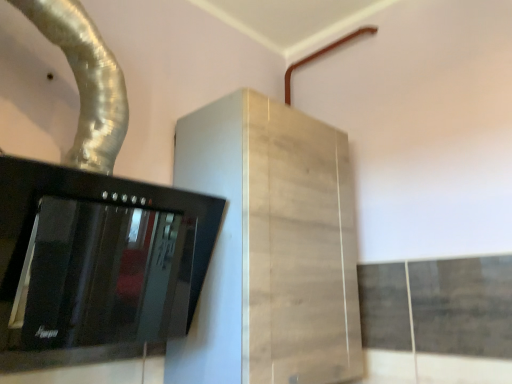
The width and height of the screenshot is (512, 384). What are the coordinates of `light wood cabinet at center` in the screenshot? It's located at (271, 247).

This screenshot has height=384, width=512. Describe the element at coordinates (96, 264) in the screenshot. I see `black glass stove at left` at that location.

What do you see at coordinates (322, 54) in the screenshot?
I see `brown matte pipe at upper right` at bounding box center [322, 54].

Locate an element on the screen. silver metallic duct at upper left is located at coordinates point(86,81).

I want to click on light wood cabinet at center, so click(x=271, y=247).

From a real-world perspective, is silver metallic duct at upper left on top of brown matte pipe at upper right?

No.

Does silver metallic duct at upper left have a smaller size compared to brown matte pipe at upper right?

No, silver metallic duct at upper left is not smaller than brown matte pipe at upper right.

Considering the relative sizes of silver metallic duct at upper left and brown matte pipe at upper right in the image provided, is silver metallic duct at upper left shorter than brown matte pipe at upper right?

Incorrect, the height of silver metallic duct at upper left does not fall short of that of brown matte pipe at upper right.

How many degrees apart are the facing directions of silver metallic duct at upper left and brown matte pipe at upper right?

87.6 degrees.

At what (x,y) coordinates should I click in order to perform the action: click on water pipe located above the light wood cabinet at center (from a real-world perspective). Please return your answer as a coordinate pair (x, y). The width and height of the screenshot is (512, 384). Looking at the image, I should click on (86, 81).

From the image's perspective, would you say light wood cabinet at center is positioned over silver metallic duct at upper left?

No, from the image's perspective, light wood cabinet at center is not on top of silver metallic duct at upper left.

Is light wood cabinet at center positioned with its back to silver metallic duct at upper left?

light wood cabinet at center does not have its back to silver metallic duct at upper left.

Which of these two, light wood cabinet at center or silver metallic duct at upper left, stands taller?

light wood cabinet at center.

Consider the image. Is black glass stove at left in contact with brown matte pipe at upper right?

No, black glass stove at left is not next to brown matte pipe at upper right.

Is point (42, 245) farther from viewer compared to point (348, 40)?

No, it is in front of (348, 40).

You are a GUI agent. You are given a task and a screenshot of the screen. Output one action in this format:
    pyautogui.click(x=<x>, y=<y>)
    Task: Click on the home appliance to the left of brown matte pipe at upper right
    Image resolution: width=512 pixels, height=384 pixels.
    Given the screenshot: What is the action you would take?
    pyautogui.click(x=96, y=264)

Could you tell me if black glass stove at left is facing brown matte pipe at upper right?

No, black glass stove at left is not aimed at brown matte pipe at upper right.

Between black glass stove at left and light wood cabinet at center, which one appears on the left side from the viewer's perspective?

From the viewer's perspective, black glass stove at left appears more on the left side.

In the scene shown: Does black glass stove at left have a lesser width compared to light wood cabinet at center?

Correct, the width of black glass stove at left is less than that of light wood cabinet at center.

Who is bigger, black glass stove at left or light wood cabinet at center?

A: light wood cabinet at center.

Which object is further away from the camera taking this photo, black glass stove at left or light wood cabinet at center?

light wood cabinet at center.

Which of these two, light wood cabinet at center or brown matte pipe at upper right, is wider?

light wood cabinet at center.

Does light wood cabinet at center appear on the left side of brown matte pipe at upper right?

Indeed, light wood cabinet at center is positioned on the left side of brown matte pipe at upper right.

Are light wood cabinet at center and brown matte pipe at upper right making contact?

light wood cabinet at center and brown matte pipe at upper right are not in contact.

From the picture: From the image's perspective, does silver metallic duct at upper left appear lower than black glass stove at left?

No, from the image's perspective, silver metallic duct at upper left is not below black glass stove at left.

What's the angular difference between silver metallic duct at upper left and black glass stove at left's facing directions?

0.952 degrees.

How much distance is there between silver metallic duct at upper left and black glass stove at left?

silver metallic duct at upper left and black glass stove at left are 10.26 inches apart from each other.

Considering the sizes of objects silver metallic duct at upper left and black glass stove at left in the image provided, who is shorter, silver metallic duct at upper left or black glass stove at left?

black glass stove at left.

From a real-world perspective, is brown matte pipe at upper right on black glass stove at left?

Yes, from a real-world perspective, brown matte pipe at upper right is above black glass stove at left.

Are brown matte pipe at upper right and black glass stove at left located far from each other?

brown matte pipe at upper right is positioned a significant distance from black glass stove at left.

Is brown matte pipe at upper right looking in the opposite direction of black glass stove at left?

That's not correct — brown matte pipe at upper right is not looking away from black glass stove at left.

Locate an element on the screen. The height and width of the screenshot is (384, 512). water pipe on the left of brown matte pipe at upper right is located at coordinates (86, 81).

The image size is (512, 384). I want to click on water pipe positioned vertically above the light wood cabinet at center (from a real-world perspective), so pos(86,81).

Which object lies further to the anchor point light wood cabinet at center, black glass stove at left or brown matte pipe at upper right?

brown matte pipe at upper right.

Looking at the image, which one is located further to silver metallic duct at upper left, black glass stove at left or brown matte pipe at upper right?

Among the two, brown matte pipe at upper right is located further to silver metallic duct at upper left.

Considering their positions, is black glass stove at left positioned closer to brown matte pipe at upper right than light wood cabinet at center?

The object closer to brown matte pipe at upper right is light wood cabinet at center.

Estimate the real-world distances between objects in this image. Which object is closer to brown matte pipe at upper right, silver metallic duct at upper left or light wood cabinet at center?

light wood cabinet at center lies closer to brown matte pipe at upper right than the other object.

Looking at the image, which one is located further to black glass stove at left, silver metallic duct at upper left or light wood cabinet at center?

silver metallic duct at upper left is positioned further to the anchor black glass stove at left.

Consider the image. Considering their positions, is brown matte pipe at upper right positioned further to light wood cabinet at center than silver metallic duct at upper left?

brown matte pipe at upper right lies further to light wood cabinet at center than the other object.

Looking at the image, which one is located closer to brown matte pipe at upper right, light wood cabinet at center or black glass stove at left?

Among the two, light wood cabinet at center is located nearer to brown matte pipe at upper right.

Looking at the image, which one is located further to silver metallic duct at upper left, brown matte pipe at upper right or black glass stove at left?

Based on the image, brown matte pipe at upper right appears to be further to silver metallic duct at upper left.

Locate an element on the screen. The image size is (512, 384). cabinetry between silver metallic duct at upper left and black glass stove at left in the up-down direction is located at coordinates (271, 247).

This screenshot has width=512, height=384. Identify the location of water pipe between black glass stove at left and brown matte pipe at upper right in the front-back direction. (86, 81).

At what (x,y) coordinates should I click in order to perform the action: click on cabinetry between black glass stove at left and brown matte pipe at upper right in the front-back direction. Please return your answer as a coordinate pair (x, y). Looking at the image, I should click on (271, 247).

The height and width of the screenshot is (384, 512). Find the location of `cabinetry between silver metallic duct at upper left and brown matte pipe at upper right in the horizontal direction`. cabinetry between silver metallic duct at upper left and brown matte pipe at upper right in the horizontal direction is located at coordinates (271, 247).